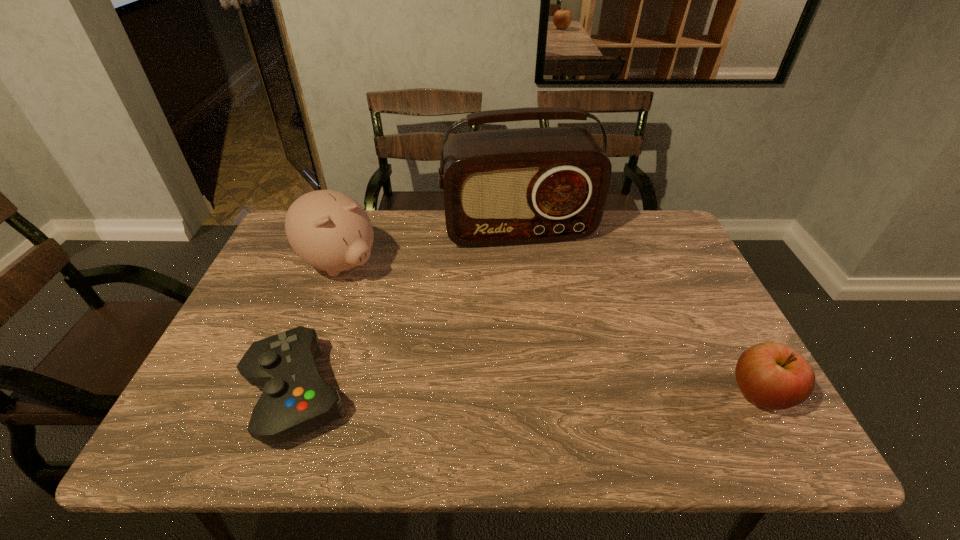
In order to click on vacant space on the desktop that is between the shortest object and the rightmost object and is positioned at the snout of the piggy bank in this screenshot , I will do pos(508,393).

Locate an element on the screen. The image size is (960, 540). vacant spot on the desktop that is between the control and the third tallest object and is positioned on the front panel of the second object from right to left is located at coordinates (567, 393).